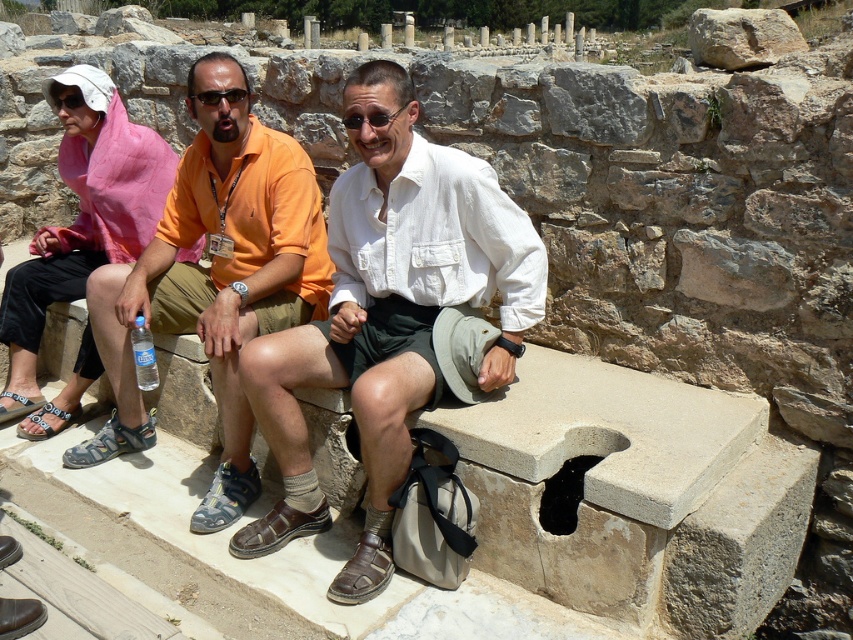
Based on the scene description, which of the two shirts, the white cotton shirt at center or the orange cotton shirt at left, has a narrower width?

The white cotton shirt at center is thinner than the orange cotton shirt at left, so the white cotton shirt at center has a narrower width.

You are a tour guide leading a group at an archaeological site. You need to ensure that visitors maintain a minimum distance of 24 inches between each other for safety. Based on the image provided, is the distance between the white cotton shirt at center and orange cotton shirt at left compliant with the safety guidelines?

The distance between the white cotton shirt at center and orange cotton shirt at left is 26.21 inches, which exceeds the required 24 inches. Therefore, the safety guidelines are being followed.

You are a photographer trying to capture a closeup of the orange cotton shirt at left and the gray fabric sandal at lower left. Which object should you zoom in on first to ensure it fits in the frame?

The orange cotton shirt at left is larger in size than the gray fabric sandal at lower left, so you should zoom in on the orange cotton shirt at left first to ensure it fits in the frame.